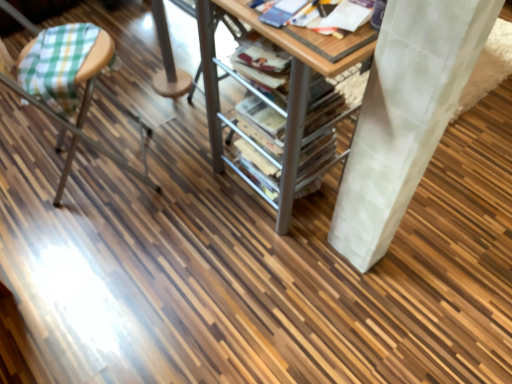
Identify the location of vacant space underneath green plaid fabric stool at left (from a real-world perspective). The width and height of the screenshot is (512, 384). (99, 172).